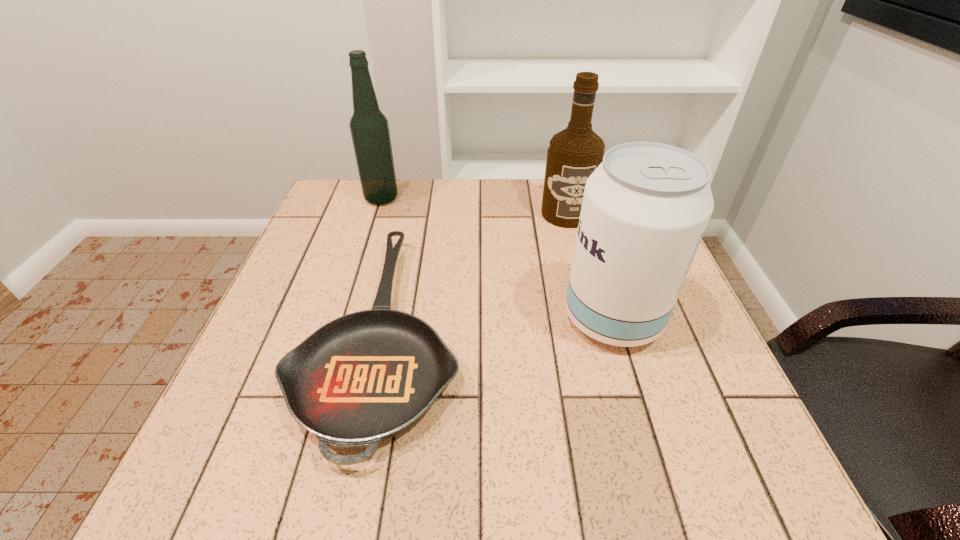
I want to click on the leftmost alcohol, so click(x=369, y=127).

Identify the location of the nearest alcohol. The height and width of the screenshot is (540, 960). (645, 208).

I want to click on the shortest object, so [x=367, y=376].

Find the location of a particular element. This screenshot has width=960, height=540. vacant point located on the right of the leftmost alcohol is located at coordinates (523, 198).

The image size is (960, 540). What are the coordinates of `vacant region located 0.250m on the front of the nearest alcohol` in the screenshot? It's located at (666, 496).

You are a GUI agent. You are given a task and a screenshot of the screen. Output one action in this format:
    pyautogui.click(x=<x>, y=<y>)
    Task: Click on the free region located 0.370m on the right of the frying pan
    Image resolution: width=960 pixels, height=540 pixels.
    Given the screenshot: What is the action you would take?
    pyautogui.click(x=650, y=334)

Find the location of a particular element. This screenshot has width=960, height=540. object present at the near edge is located at coordinates (367, 376).

Where is `alcohol located in the left edge section of the desktop`? This screenshot has height=540, width=960. alcohol located in the left edge section of the desktop is located at coordinates (369, 127).

Where is `frying pan at the left edge`? frying pan at the left edge is located at coordinates (367, 376).

Locate an element on the screen. This screenshot has height=540, width=960. object that is at the far left corner is located at coordinates (x=369, y=127).